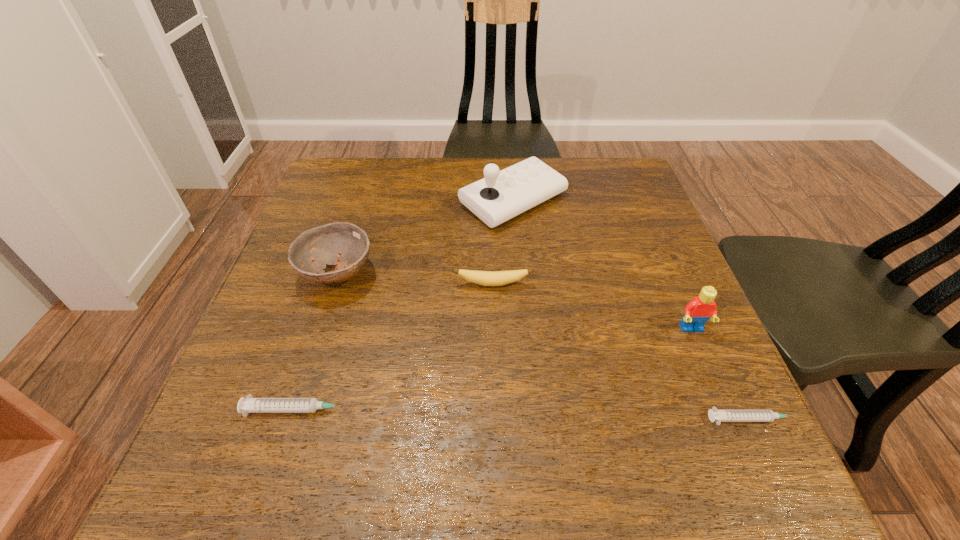
Locate an element on the screen. Image resolution: width=960 pixels, height=540 pixels. object that is at the near left corner is located at coordinates (249, 405).

Identify the location of object positioned at the near right corner. (718, 416).

What are the coordinates of `free space at the far edge of the desktop` in the screenshot? It's located at (559, 167).

Where is `free space at the near edge`? The width and height of the screenshot is (960, 540). free space at the near edge is located at coordinates (429, 426).

The height and width of the screenshot is (540, 960). In order to click on vacant space at the left edge of the desktop in this screenshot , I will do `click(270, 307)`.

In the image, there is a desktop. Where is `free space at the right edge`? The image size is (960, 540). free space at the right edge is located at coordinates (693, 359).

You are a GUI agent. You are given a task and a screenshot of the screen. Output one action in this format:
    pyautogui.click(x=<x>, y=<y>)
    Task: Click on the vacant space at the far left corner
    
    Given the screenshot: What is the action you would take?
    pyautogui.click(x=323, y=182)

This screenshot has width=960, height=540. In the image, there is a desktop. What are the coordinates of `free space at the far right corner` in the screenshot? It's located at (598, 167).

Find the location of a particular element. vacant space at the near right corner of the desktop is located at coordinates (738, 391).

The height and width of the screenshot is (540, 960). Find the location of `blank region between the taller syringe and the shortest object`. blank region between the taller syringe and the shortest object is located at coordinates (527, 414).